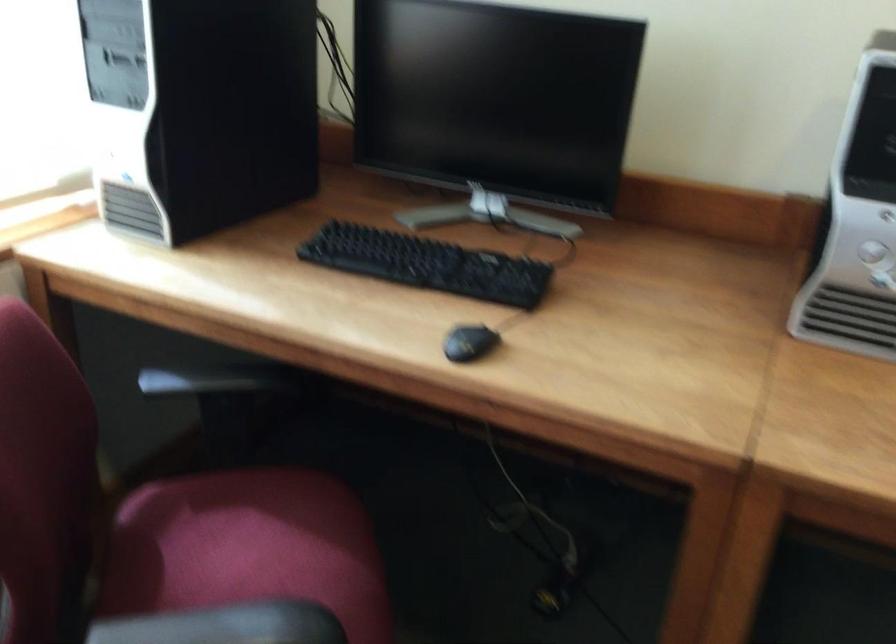
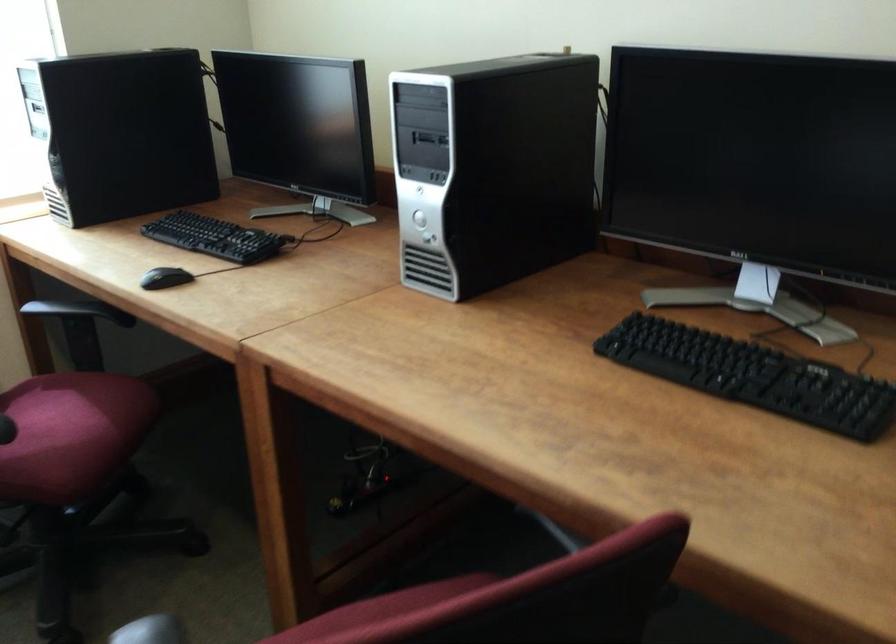
Find the pixel in the second image that matches (308,573) in the first image.

(73, 428)